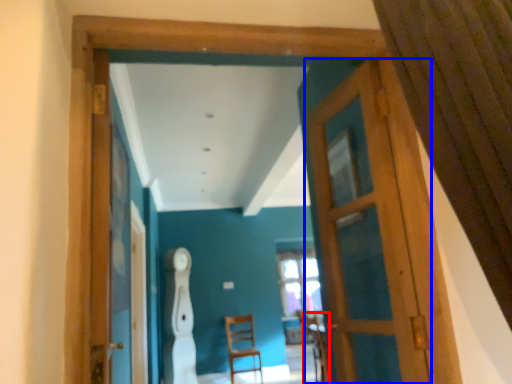
Question: Among these objects, which one is nearest to the camera, armchair (highlighted by a red box) or door (highlighted by a blue box)?

Choices:
 (A) armchair
 (B) door

Answer: (B)